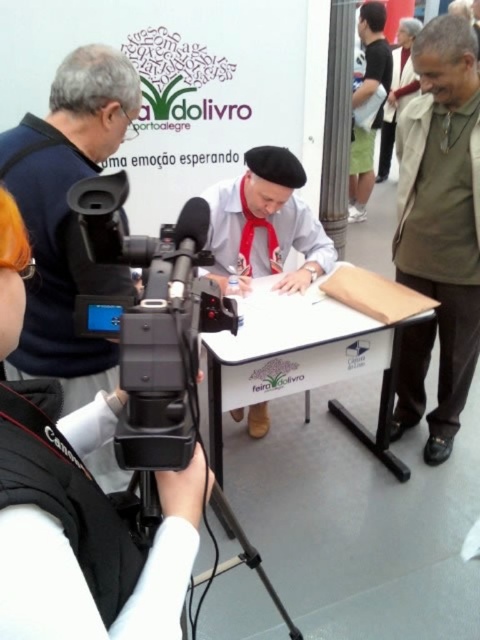
Which is above, khaki cotton jacket at right or black plastic video camera at left?

khaki cotton jacket at right

Does point (415, 269) lie behind point (99, 326)?

Yes, it is behind point (99, 326).

Identify the location of khaki cotton jacket at right. This screenshot has height=640, width=480. (440, 228).

The width and height of the screenshot is (480, 640). I want to click on khaki cotton jacket at right, so click(440, 228).

Which is behind, point (253, 563) or point (391, 90)?

The point (391, 90) is more distant.

Does black plastic tripod at lower center have a larger size compared to light beige fabric at upper right?

Incorrect, black plastic tripod at lower center is not larger than light beige fabric at upper right.

Between point (130, 513) and point (404, 42), which one is positioned in front?

Point (130, 513)

Where is `black plastic tripod at lower center`? The width and height of the screenshot is (480, 640). black plastic tripod at lower center is located at coordinates (247, 556).

Can you confirm if white paperboard table at center is smaller than white cotton shirt at center?

Incorrect, white paperboard table at center is not smaller in size than white cotton shirt at center.

Identify the location of white paperboard table at center. This screenshot has width=480, height=640. (313, 352).